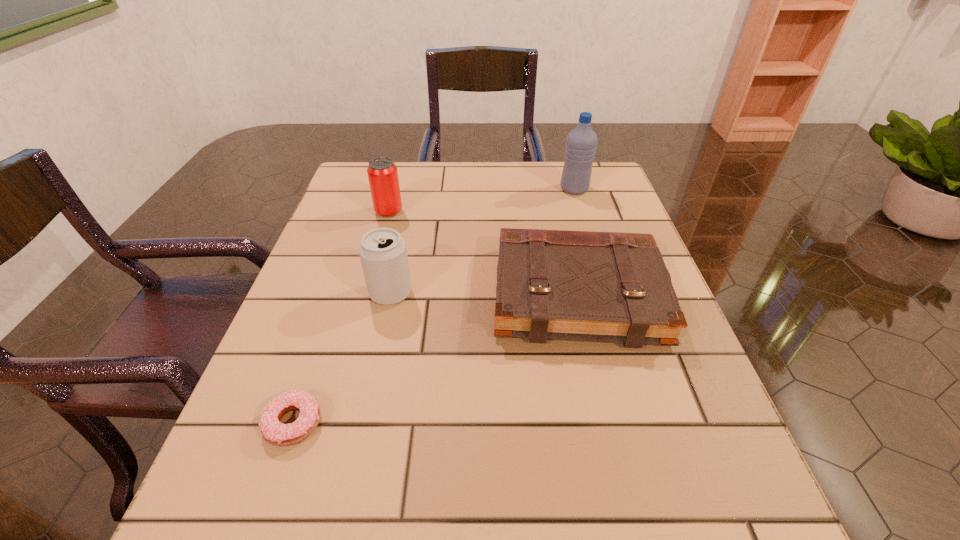
You are a GUI agent. You are given a task and a screenshot of the screen. Output one action in this format:
    pyautogui.click(x=<x>, y=<y>)
    Task: Click on the vacant position located on the front of the hardback book
    The width and height of the screenshot is (960, 540).
    Given the screenshot: What is the action you would take?
    pyautogui.click(x=627, y=507)

This screenshot has height=540, width=960. In order to click on vacant area located 0.220m on the back of the doughnut in this screenshot , I will do `click(336, 301)`.

In order to click on water bottle located at the far edge in this screenshot , I will do [581, 143].

This screenshot has height=540, width=960. Identify the location of can that is at the far edge. (382, 172).

At what (x,y) coordinates should I click in order to perform the action: click on doughnut present at the left edge. Please return your answer as a coordinate pair (x, y). The image size is (960, 540). Looking at the image, I should click on (279, 434).

Identify the location of water bottle at the right edge. (581, 143).

Locate an element on the screen. The image size is (960, 540). hardback book situated at the right edge is located at coordinates (551, 284).

At what (x,y) coordinates should I click in order to perform the action: click on object located in the far left corner section of the desktop. Please return your answer as a coordinate pair (x, y). This screenshot has height=540, width=960. Looking at the image, I should click on (382, 172).

The height and width of the screenshot is (540, 960). I want to click on object present at the far right corner, so click(x=581, y=143).

The height and width of the screenshot is (540, 960). I want to click on vacant space at the far edge of the desktop, so click(x=416, y=185).